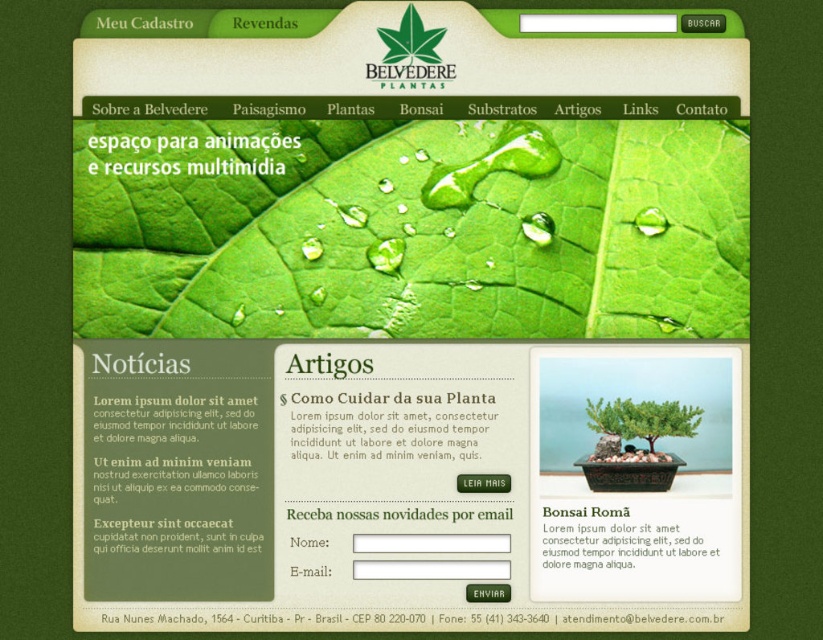
You are navigating the Belvedere Plantas website and see two points on the screen. Which point, point (336, 280) or point (393, 58), is closer to you?

Point (336, 280) is in front of point (393, 58), so it is closer to you.

You are designing a website layout and need to ensure that the green matte bonsai tree at center and the green matte leaf at upper center are properly positioned. Based on their sizes, which object should be placed lower to maintain visual balance?

The green matte bonsai tree at center has a lesser height compared to the green matte leaf at upper center, so to maintain visual balance, the bonsai tree should be placed lower than the leaf.